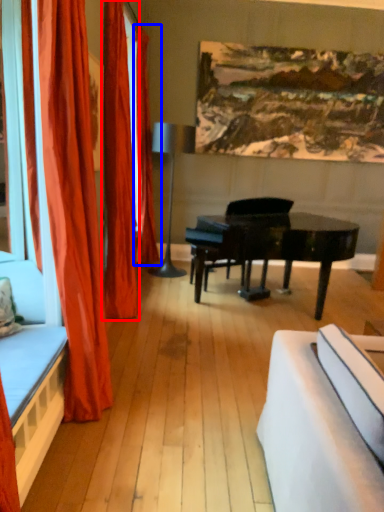
Question: Among these objects, which one is nearest to the camera, curtain (highlighted by a red box) or curtain (highlighted by a blue box)?

Choices:
 (A) curtain
 (B) curtain

Answer: (A)